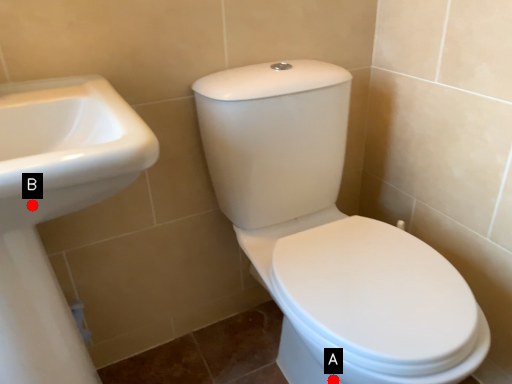
Question: Two points are circled on the image, labeled by A and B beside each circle. Which point appears closest to the camera in this image?

Choices:
 (A) A is closer
 (B) B is closer

Answer: (B)